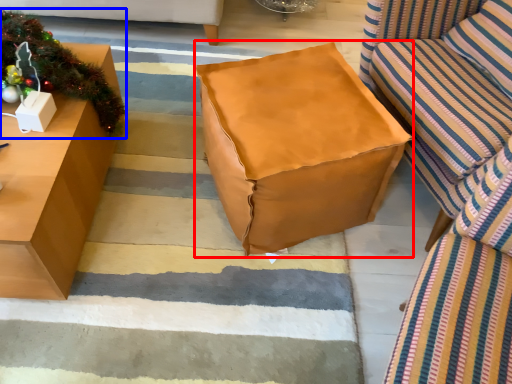
Question: Which object appears farthest to the camera in this image, bean bag chair (highlighted by a red box) or christmas decoration (highlighted by a blue box)?

Choices:
 (A) bean bag chair
 (B) christmas decoration

Answer: (B)